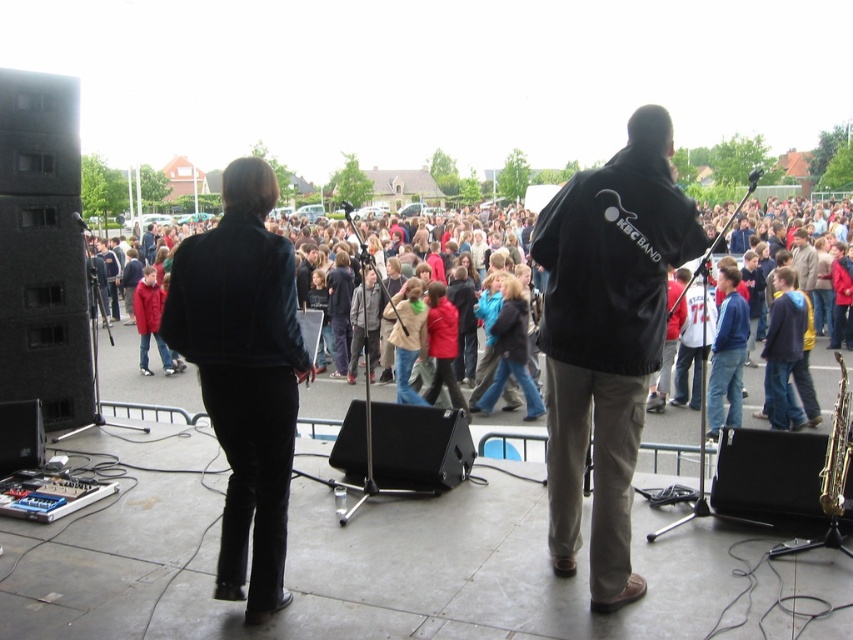
Question: Which point appears closest to the camera in this image?

Choices:
 (A) (850, 404)
 (B) (616, 374)

Answer: (B)

Question: Which point is closer to the camera?

Choices:
 (A) (839, 474)
 (B) (664, 326)

Answer: (B)

Question: Among these points, which one is nearest to the camera?

Choices:
 (A) (834, 490)
 (B) (651, 369)

Answer: (B)

Question: Is black fabric jacket at center above gold metallic saxophone at lower right?

Choices:
 (A) yes
 (B) no

Answer: (A)

Question: Does black fabric jacket at center appear on the left side of gold metallic saxophone at lower right?

Choices:
 (A) no
 (B) yes

Answer: (B)

Question: Is black fabric jacket at center thinner than gold metallic saxophone at lower right?

Choices:
 (A) yes
 (B) no

Answer: (B)